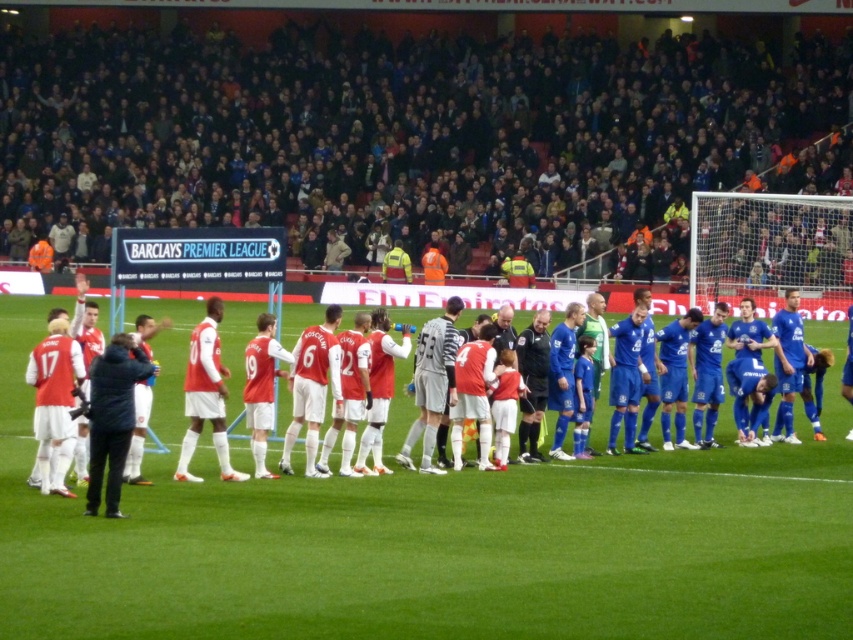
Question: Which of these objects is positioned farthest from the matte gray jersey at center?

Choices:
 (A) black fabric jacket at left
 (B) matte red jersey at center

Answer: (B)

Question: From the image, what is the correct spatial relationship of black fabric jacket at left in relation to matte gray jersey at center?

Choices:
 (A) right
 (B) left

Answer: (B)

Question: Can you confirm if black fabric jacket at left is positioned to the right of matte gray jersey at center?

Choices:
 (A) yes
 (B) no

Answer: (B)

Question: Which point is closer to the camera?

Choices:
 (A) matte red jersey at center
 (B) black fabric jacket at left
 (C) matte gray jersey at center

Answer: (B)

Question: Which of the following is the closest to the observer?

Choices:
 (A) matte red jersey at center
 (B) black fabric jacket at left
 (C) matte gray jersey at center

Answer: (B)

Question: Can you confirm if matte red jersey at center is positioned below matte gray jersey at center?

Choices:
 (A) yes
 (B) no

Answer: (B)